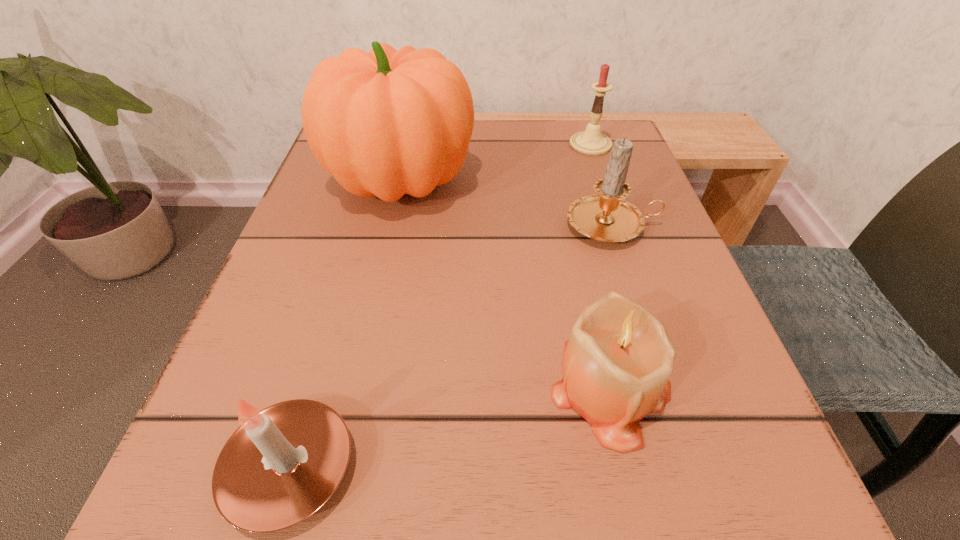
This screenshot has width=960, height=540. In order to click on pumpkin in this screenshot , I will do `click(386, 123)`.

Locate an element on the screen. The width and height of the screenshot is (960, 540). the farthest candle is located at coordinates (591, 142).

Identify the location of the third nearest candle. (606, 216).

You are a GUI agent. You are given a task and a screenshot of the screen. Output one action in this format:
    pyautogui.click(x=<x>, y=<y>)
    Task: Click on the vacant area situated on the front of the pumpkin
    The image size is (960, 540).
    Given the screenshot: What is the action you would take?
    pyautogui.click(x=362, y=354)

You are a GUI agent. You are given a task and a screenshot of the screen. Output one action in this format:
    pyautogui.click(x=<x>, y=<y>)
    Task: Click on the vacant space located 0.120m on the front of the farthest candle
    
    Given the screenshot: What is the action you would take?
    pyautogui.click(x=606, y=190)

Where is `free space located 0.240m on the left of the second farthest candle`? free space located 0.240m on the left of the second farthest candle is located at coordinates (423, 226).

The image size is (960, 540). I want to click on pumpkin that is at the far edge, so click(386, 123).

Locate an element on the screen. This screenshot has height=540, width=960. candle at the far edge is located at coordinates (591, 142).

Locate an element on the screen. object at the left edge is located at coordinates (386, 123).

This screenshot has width=960, height=540. In order to click on object located at the far left corner in this screenshot , I will do `click(386, 123)`.